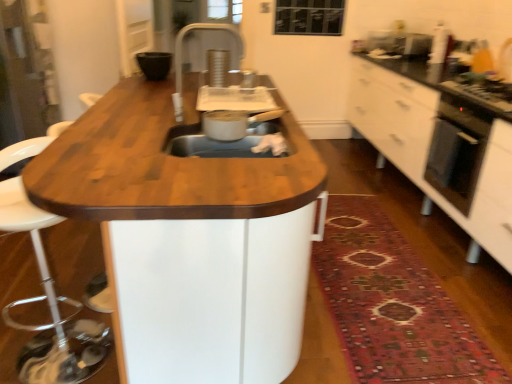
Question: Is black matte bowl at upper center surrounding wooden table at center?

Choices:
 (A) no
 (B) yes

Answer: (A)

Question: Is black matte bowl at upper center taller than wooden table at center?

Choices:
 (A) yes
 (B) no

Answer: (B)

Question: Is black matte bowl at upper center turned away from wooden table at center?

Choices:
 (A) no
 (B) yes

Answer: (A)

Question: Does black matte bowl at upper center appear on the left side of wooden table at center?

Choices:
 (A) yes
 (B) no

Answer: (A)

Question: Can you confirm if black matte bowl at upper center is shorter than wooden table at center?

Choices:
 (A) yes
 (B) no

Answer: (A)

Question: From the image's perspective, is black matte bowl at upper center located beneath wooden table at center?

Choices:
 (A) yes
 (B) no

Answer: (B)

Question: Could you tell me if black glass oven at right is facing silver metallic faucet at upper center?

Choices:
 (A) no
 (B) yes

Answer: (B)

Question: Is black glass oven at right not within silver metallic faucet at upper center?

Choices:
 (A) yes
 (B) no

Answer: (A)

Question: Does black glass oven at right have a lesser height compared to silver metallic faucet at upper center?

Choices:
 (A) yes
 (B) no

Answer: (B)

Question: From the image's perspective, is black glass oven at right located above silver metallic faucet at upper center?

Choices:
 (A) no
 (B) yes

Answer: (A)

Question: Does black glass oven at right appear on the right side of silver metallic faucet at upper center?

Choices:
 (A) no
 (B) yes

Answer: (B)

Question: Is black glass oven at right to the left of silver metallic faucet at upper center from the viewer's perspective?

Choices:
 (A) yes
 (B) no

Answer: (B)

Question: Considering the relative sizes of wooden table at center and white glossy cabinet at right in the image provided, is wooden table at center bigger than white glossy cabinet at right?

Choices:
 (A) no
 (B) yes

Answer: (A)